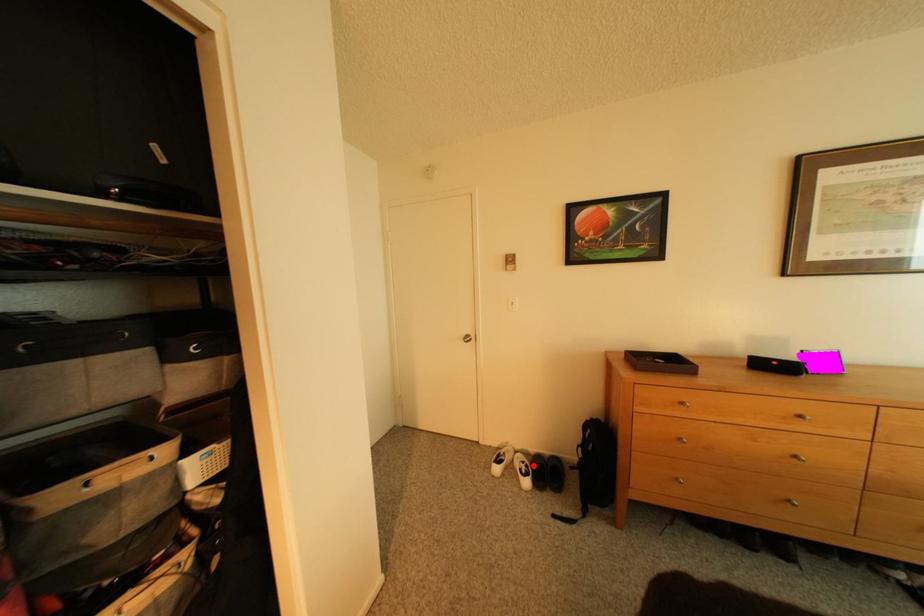
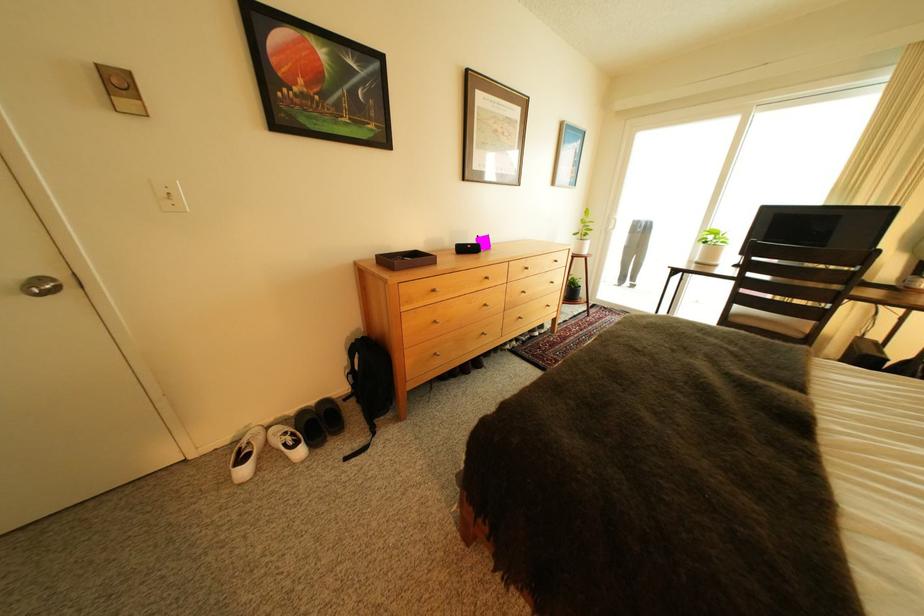
The point at the highlighted location is marked in the first image. Where is the corresponding point in the second image?

(296, 439)